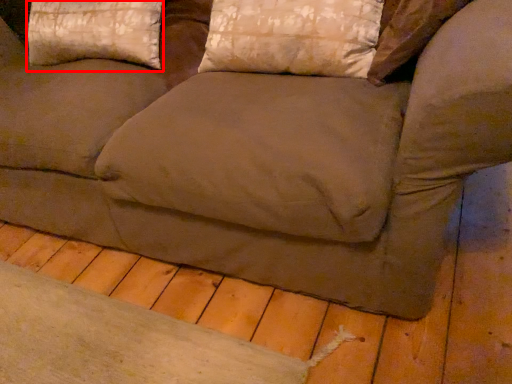
Question: In this image, where is pillow (annotated by the red box) located relative to pillow?

Choices:
 (A) right
 (B) left

Answer: (B)